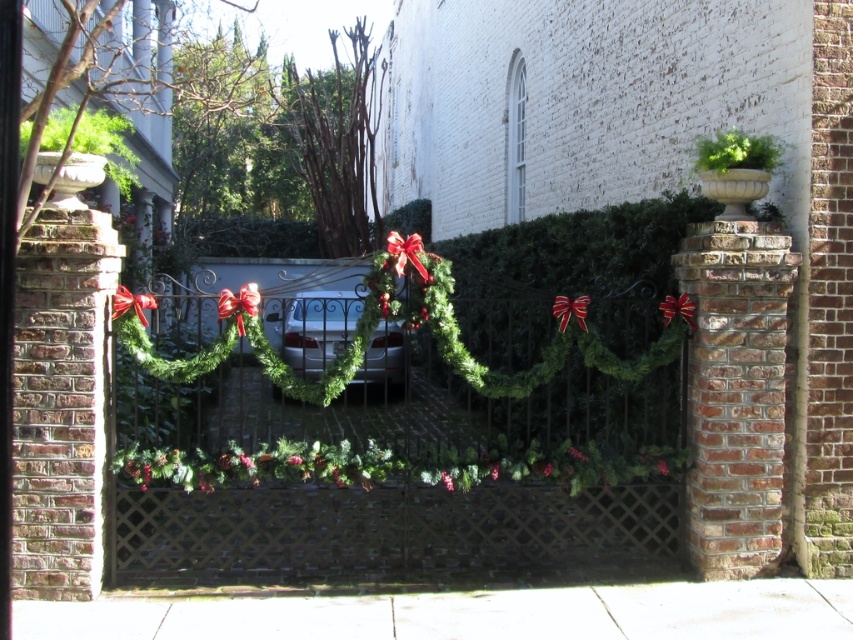
Question: Can you confirm if green garland at center is positioned to the right of shiny silver car at center?

Choices:
 (A) no
 (B) yes

Answer: (B)

Question: Which object is farther from the camera taking this photo?

Choices:
 (A) green garland at center
 (B) shiny silver car at center

Answer: (B)

Question: Which of the following is the farthest from the observer?

Choices:
 (A) shiny silver car at center
 (B) green garland at center

Answer: (A)

Question: Is green garland at center thinner than shiny silver car at center?

Choices:
 (A) no
 (B) yes

Answer: (A)

Question: Does green garland at center have a greater width compared to shiny silver car at center?

Choices:
 (A) no
 (B) yes

Answer: (B)